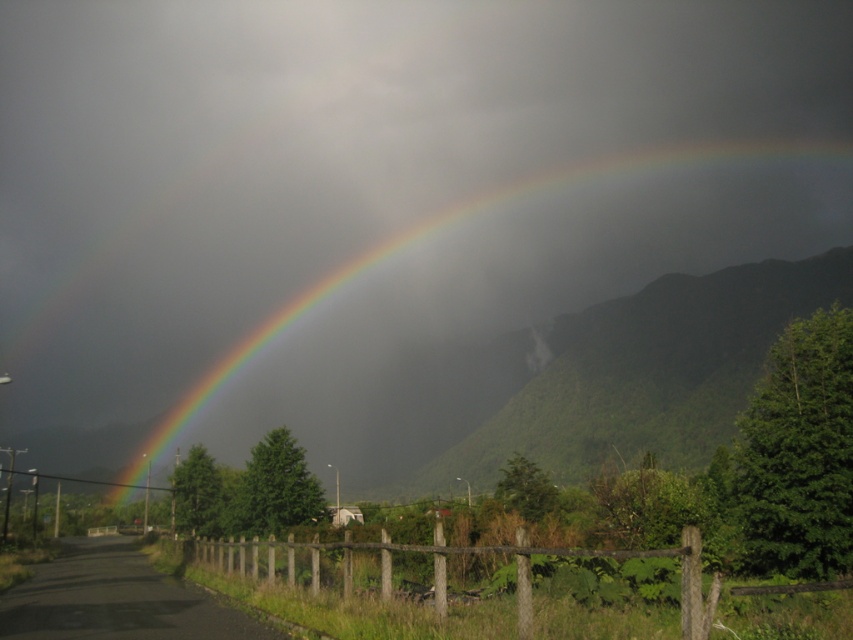
In the scene shown: Between rainbow at upper center and green leafy mountain at center, which one is positioned higher?

rainbow at upper center

At what (x,y) coordinates should I click in order to perform the action: click on rainbow at upper center. Please return your answer as a coordinate pair (x, y). The height and width of the screenshot is (640, 853). Looking at the image, I should click on (552, 348).

Does green leafy mountain at center have a greater width compared to brown wooden fence at lower center?

Yes, green leafy mountain at center is wider than brown wooden fence at lower center.

Does green leafy mountain at center appear over brown wooden fence at lower center?

Yes.

Measure the distance between green leafy mountain at center and camera.

The distance of green leafy mountain at center from camera is 58.32 meters.

At what (x,y) coordinates should I click in order to perform the action: click on green leafy mountain at center. Please return your answer as a coordinate pair (x, y). This screenshot has width=853, height=640. Looking at the image, I should click on (643, 372).

Does rainbow at upper center have a greater height compared to brown wooden fence at lower center?

Indeed, rainbow at upper center has a greater height compared to brown wooden fence at lower center.

Who is more forward, (x=722, y=172) or (x=271, y=593)?

Positioned in front is point (x=271, y=593).

Describe the element at coordinates (552, 348) in the screenshot. Image resolution: width=853 pixels, height=640 pixels. I see `rainbow at upper center` at that location.

You are a GUI agent. You are given a task and a screenshot of the screen. Output one action in this format:
    pyautogui.click(x=<x>, y=<y>)
    Task: Click on the rainbow at upper center
    The image size is (853, 640).
    Given the screenshot: What is the action you would take?
    pyautogui.click(x=552, y=348)